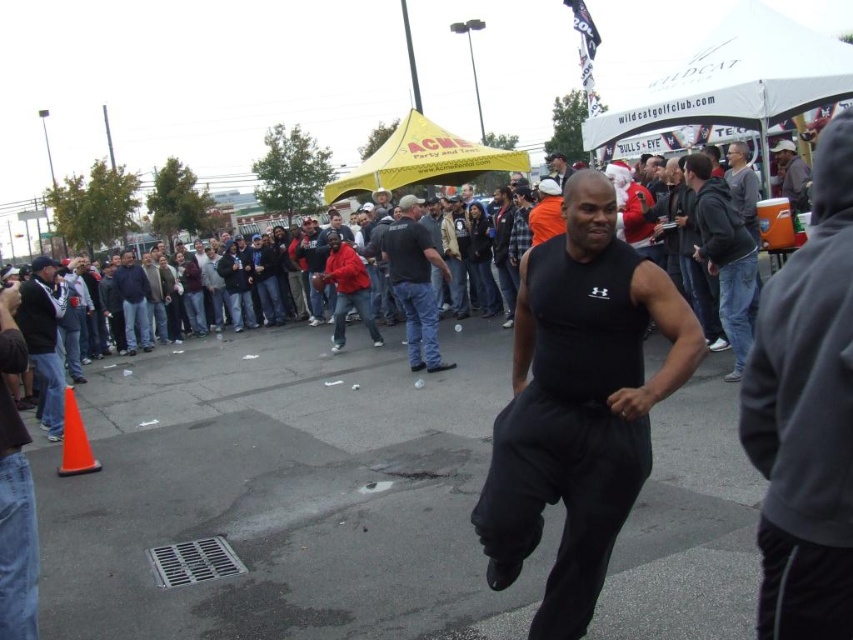
Question: Which object is farther from the camera taking this photo?

Choices:
 (A) dark gray hoodie at left
 (B) yellow fabric canopy at upper center
 (C) orange matte traffic cone at lower left
 (D) black cotton shirt at center

Answer: (B)

Question: Is dark gray hoodie at left bigger than matte black tank top at center?

Choices:
 (A) no
 (B) yes

Answer: (A)

Question: Can you confirm if white fabric canopy at upper center is positioned to the right of yellow fabric canopy at upper center?

Choices:
 (A) no
 (B) yes

Answer: (B)

Question: Does white fabric canopy at upper center come behind dark gray hoodie at upper right?

Choices:
 (A) yes
 (B) no

Answer: (B)

Question: Which object appears farthest from the camera in this image?

Choices:
 (A) matte black tank top at center
 (B) yellow fabric canopy at upper center

Answer: (B)

Question: Which object is the farthest from the yellow fabric canopy at upper center?

Choices:
 (A) matte black tank top at center
 (B) dark gray hoodie at left
 (C) white fabric canopy at upper center

Answer: (B)